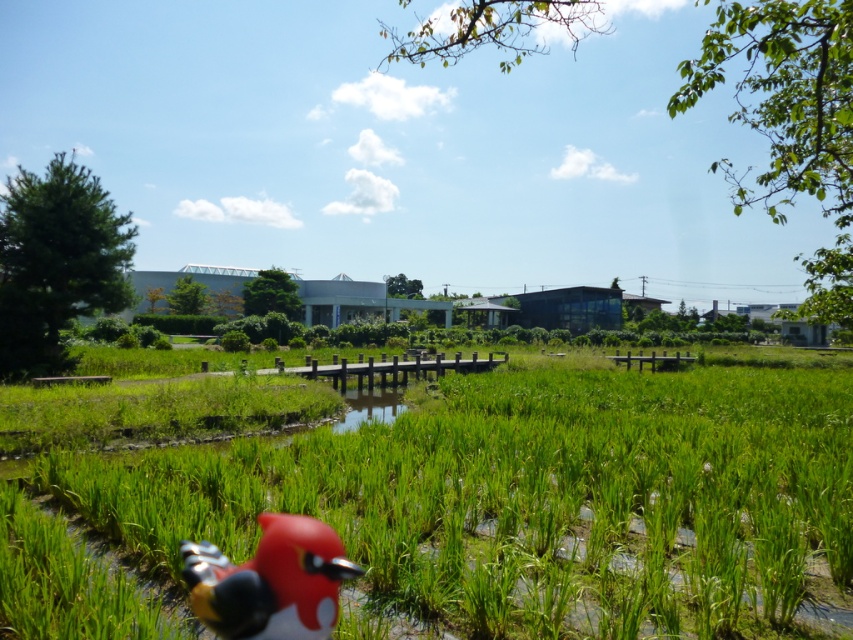
Question: Can you confirm if green grass at center is wider than rubberized red bird at lower left?

Choices:
 (A) yes
 (B) no

Answer: (A)

Question: Does green grass at center come in front of rubberized red bird at lower left?

Choices:
 (A) no
 (B) yes

Answer: (A)

Question: Which point appears farthest from the camera in this image?

Choices:
 (A) (260, 560)
 (B) (607, 488)

Answer: (B)

Question: Which point is farther from the camera taking this photo?

Choices:
 (A) (189, 556)
 (B) (607, 492)

Answer: (B)

Question: Is green grass at center positioned before rubberized red bird at lower left?

Choices:
 (A) no
 (B) yes

Answer: (A)

Question: Which of the following is the closest to the observer?

Choices:
 (A) green grass at center
 (B) rubberized red bird at lower left

Answer: (B)